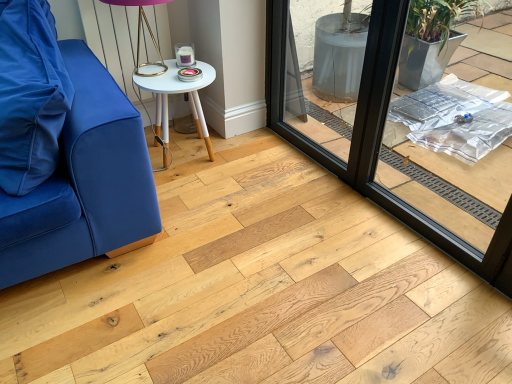
Question: In terms of size, does black glass window frame at center appear bigger or smaller than metallic gold table lamp at upper center?

Choices:
 (A) small
 (B) big

Answer: (B)

Question: Considering the positions of black glass window frame at center and metallic gold table lamp at upper center in the image, is black glass window frame at center wider or thinner than metallic gold table lamp at upper center?

Choices:
 (A) thin
 (B) wide

Answer: (A)

Question: Which object is positioned closest to the black glass window frame at center?

Choices:
 (A) white wood side table at center
 (B) matte blue cushion at left
 (C) metallic gold table lamp at upper center

Answer: (A)

Question: Considering the real-world distances, which object is closest to the matte blue cushion at left?

Choices:
 (A) black glass window frame at center
 (B) white wood side table at center
 (C) metallic gold table lamp at upper center

Answer: (C)